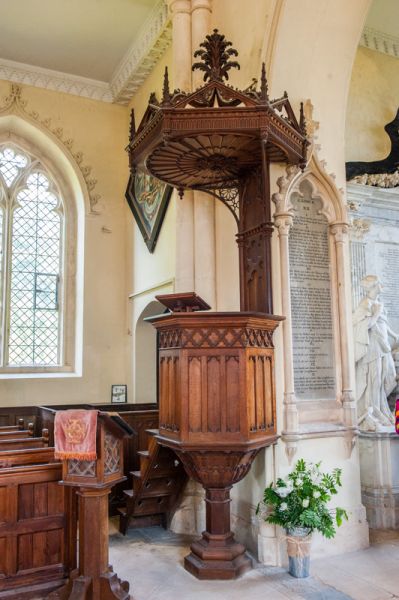
At what (x,y) coordinates should I click in order to perform the action: click on flower vase. Please return your answer as a coordinate pair (x, y). This screenshot has height=600, width=399. Looking at the image, I should click on (299, 567).